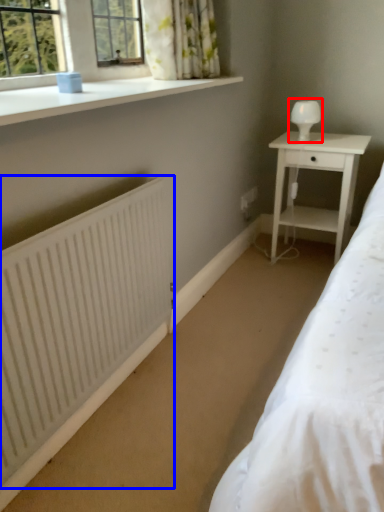
Question: Which object appears closest to the camera in this image, table lamp (highlighted by a red box) or radiator (highlighted by a blue box)?

Choices:
 (A) table lamp
 (B) radiator

Answer: (B)